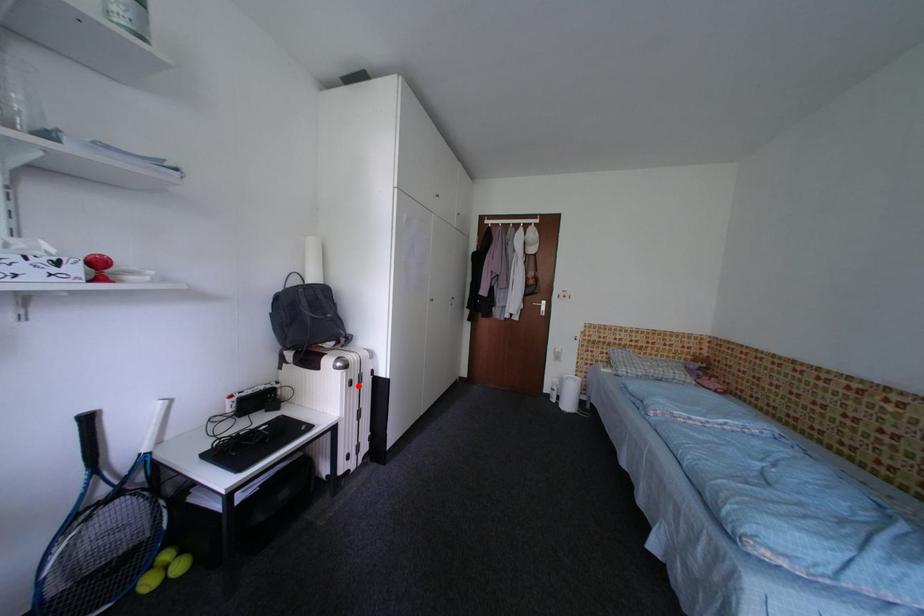
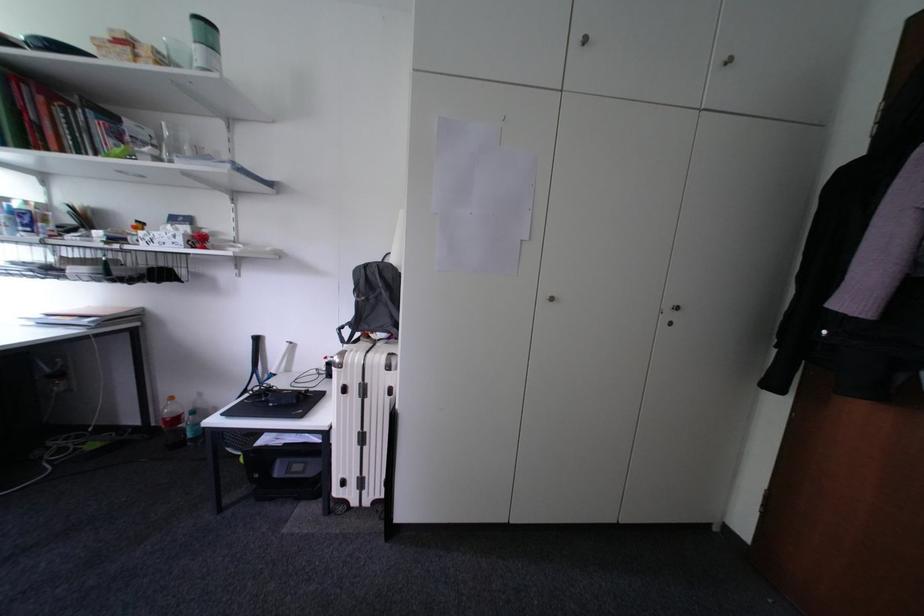
Find the pixel in the second image that matches the highlighted location in the first image.

(353, 392)